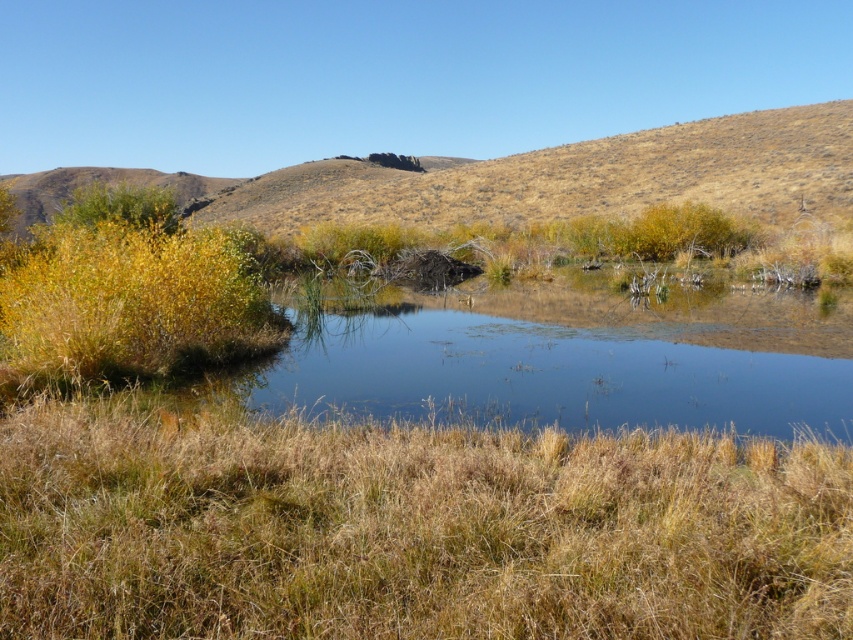
You are standing in the scene and notice two areas of dry grass. The first is labeled as dry grass at center, and the second is dry grass at upper center. From your perspective, which of these two areas is located to the right of the other?

The dry grass at center is positioned on the right side of dry grass at upper center.